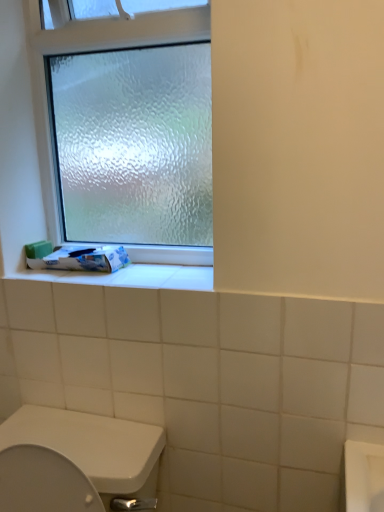
The height and width of the screenshot is (512, 384). I want to click on frosted glass window at upper left, so pos(121,31).

Describe the element at coordinates (121, 31) in the screenshot. I see `frosted glass window at upper left` at that location.

Measure the distance between point (74, 246) and camera.

Point (74, 246) is 1.25 meters from camera.

You are a GUI agent. You are given a task and a screenshot of the screen. Output one action in this format:
    pyautogui.click(x=<x>, y=<y>)
    Task: Click on the white glossy toilet paper at lower left
    This screenshot has height=512, width=384.
    Given the screenshot: What is the action you would take?
    pyautogui.click(x=82, y=259)

What do you see at coordinates (82, 259) in the screenshot?
I see `white glossy toilet paper at lower left` at bounding box center [82, 259].

Identify the location of frosted glass window at upper left. (121, 31).

Which object is positioned more to the right, white glossy toilet paper at lower left or frosted glass window at upper left?

frosted glass window at upper left is more to the right.

Which object is closer to the camera taking this photo, white glossy toilet paper at lower left or frosted glass window at upper left?

frosted glass window at upper left is more forward.

In the scene shown: Which is less distant, (75, 251) or (172, 14)?

The point (172, 14) is closer to the camera.

From the image's perspective, would you say white glossy toilet paper at lower left is positioned over frosted glass window at upper left?

No, from the image's perspective, white glossy toilet paper at lower left is not over frosted glass window at upper left.

From a real-world perspective, between white glossy toilet paper at lower left and frosted glass window at upper left, who is vertically higher?

frosted glass window at upper left is physically above.

Is white glossy toilet paper at lower left thinner than frosted glass window at upper left?

In fact, white glossy toilet paper at lower left might be wider than frosted glass window at upper left.

Between white glossy toilet paper at lower left and frosted glass window at upper left, which one has more height?

frosted glass window at upper left is taller.

Considering the relative sizes of white glossy toilet paper at lower left and frosted glass window at upper left in the image provided, is white glossy toilet paper at lower left bigger than frosted glass window at upper left?

Actually, white glossy toilet paper at lower left might be smaller than frosted glass window at upper left.

Is frosted glass window at upper left located within white glossy toilet paper at lower left?

Actually, frosted glass window at upper left is outside white glossy toilet paper at lower left.

Are white glossy toilet paper at lower left and frosted glass window at upper left beside each other?

No, white glossy toilet paper at lower left is not making contact with frosted glass window at upper left.

Is white glossy toilet paper at lower left turned away from frosted glass window at upper left?

That's right, white glossy toilet paper at lower left is facing away from frosted glass window at upper left.

Identify the location of window that is above the white glossy toilet paper at lower left (from the image's perspective). The height and width of the screenshot is (512, 384). (121, 31).

Which object is positioned more to the right, frosted glass window at upper left or white glossy toilet paper at lower left?

frosted glass window at upper left.

Between frosted glass window at upper left and white glossy toilet paper at lower left, which one is positioned in front?

frosted glass window at upper left.

Considering the points (81, 23) and (66, 246), which point is behind, point (81, 23) or point (66, 246)?

Positioned behind is point (66, 246).

From the image's perspective, which is below, frosted glass window at upper left or white glossy toilet paper at lower left?

From the image's view, white glossy toilet paper at lower left is below.

From a real-world perspective, which is physically below, frosted glass window at upper left or white glossy toilet paper at lower left?

white glossy toilet paper at lower left.

Considering the relative sizes of frosted glass window at upper left and white glossy toilet paper at lower left in the image provided, is frosted glass window at upper left wider than white glossy toilet paper at lower left?

Incorrect, the width of frosted glass window at upper left does not surpass that of white glossy toilet paper at lower left.

In terms of height, does frosted glass window at upper left look taller or shorter compared to white glossy toilet paper at lower left?

Considering their sizes, frosted glass window at upper left has more height than white glossy toilet paper at lower left.

Which of these two, frosted glass window at upper left or white glossy toilet paper at lower left, is bigger?

Bigger between the two is frosted glass window at upper left.

Is frosted glass window at upper left outside of white glossy toilet paper at lower left?

frosted glass window at upper left is positioned outside white glossy toilet paper at lower left.

Would you consider frosted glass window at upper left to be distant from white glossy toilet paper at lower left?

No, frosted glass window at upper left is not far from white glossy toilet paper at lower left.

Could you tell me if frosted glass window at upper left is facing white glossy toilet paper at lower left?

Yes, frosted glass window at upper left is facing white glossy toilet paper at lower left.

How different are the orientations of frosted glass window at upper left and white glossy toilet paper at lower left in degrees?

The facing directions of frosted glass window at upper left and white glossy toilet paper at lower left are 1.18 degrees apart.

How much distance is there between frosted glass window at upper left and white glossy toilet paper at lower left?

The distance of frosted glass window at upper left from white glossy toilet paper at lower left is 15.06 inches.

Locate an element on the screen. The width and height of the screenshot is (384, 512). window in front of the white glossy toilet paper at lower left is located at coordinates (121, 31).

At what (x,y) coordinates should I click in order to perform the action: click on toilet paper below the frosted glass window at upper left (from the image's perspective). Please return your answer as a coordinate pair (x, y). Looking at the image, I should click on (82, 259).

You are a GUI agent. You are given a task and a screenshot of the screen. Output one action in this format:
    pyautogui.click(x=<x>, y=<y>)
    Task: Click on the window on the right side of white glossy toilet paper at lower left
    
    Given the screenshot: What is the action you would take?
    pyautogui.click(x=121, y=31)